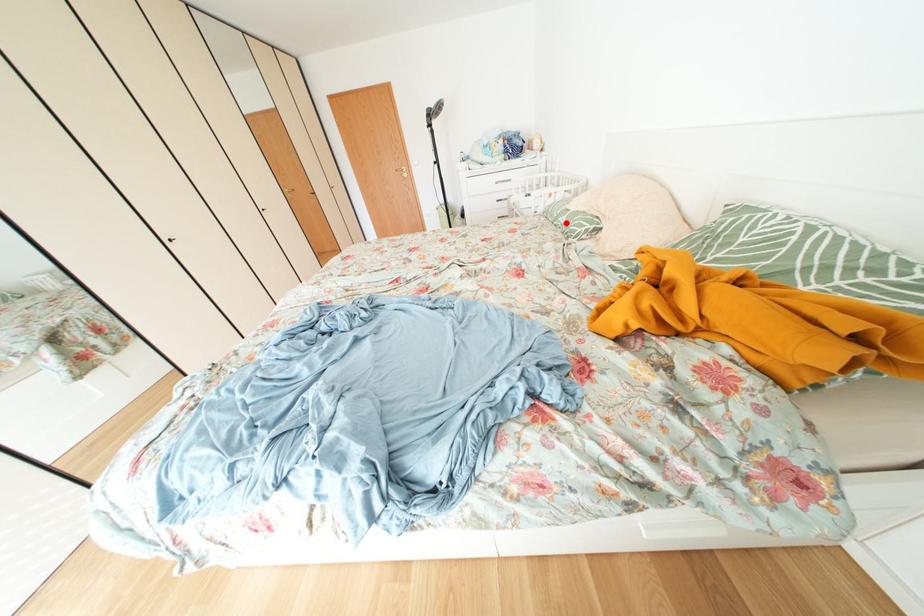
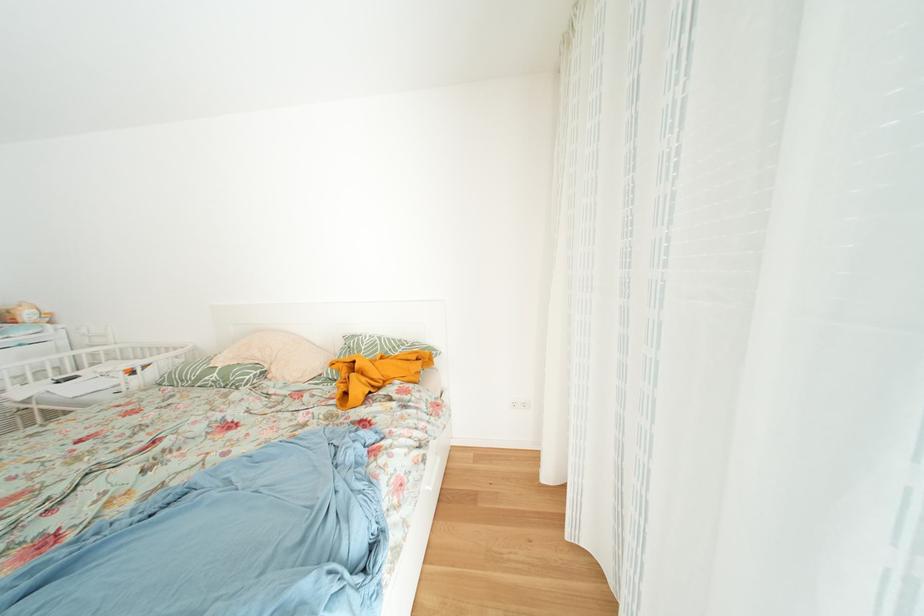
Where in the second image is the point corresponding to the highlighted location from the first image?

(208, 384)